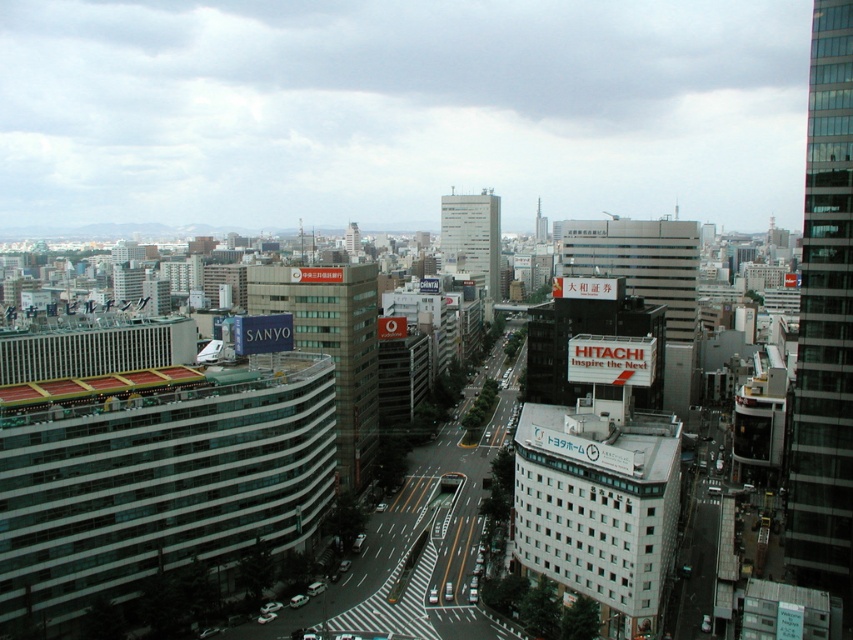
Measure the distance between point (819, 353) and camera.

A distance of 116.43 meters exists between point (819, 353) and camera.

Image resolution: width=853 pixels, height=640 pixels. What are the coordinates of `transparent glass skyscraper at right` in the screenshot? It's located at (824, 323).

Between green glass building at center and white glass building at center, which one has less height?

Standing shorter between the two is green glass building at center.

What do you see at coordinates (332, 346) in the screenshot? I see `green glass building at center` at bounding box center [332, 346].

This screenshot has height=640, width=853. Find the location of `green glass building at center`. green glass building at center is located at coordinates (332, 346).

Is transparent glass skyscraper at right above white glass building at center?

No, transparent glass skyscraper at right is not above white glass building at center.

Does transparent glass skyscraper at right have a larger size compared to white glass building at center?

No.

Who is more forward, (822, 12) or (456, 209)?

Point (822, 12) is more forward.

The height and width of the screenshot is (640, 853). In order to click on transparent glass skyscraper at right in this screenshot , I will do `click(824, 323)`.